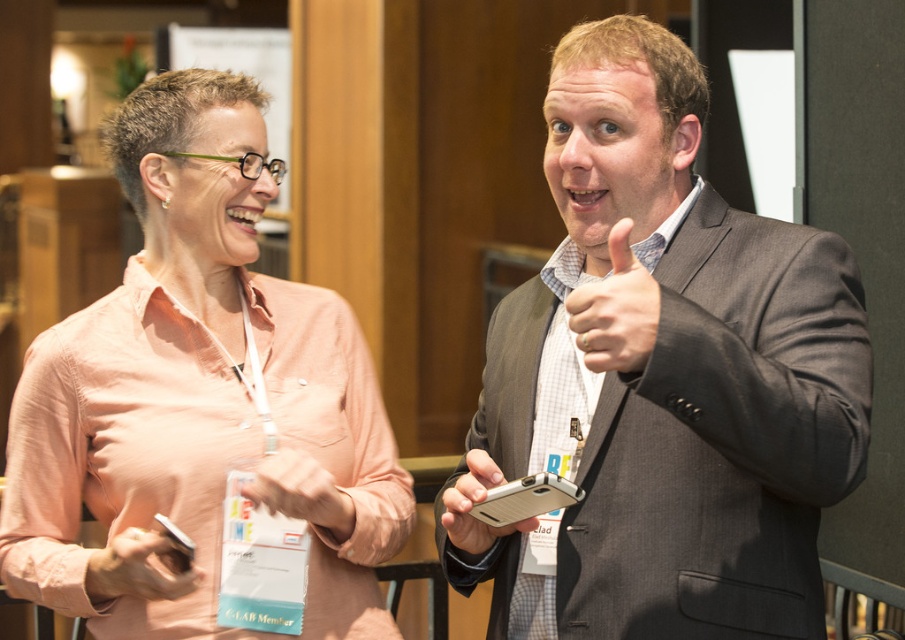
Describe the element at coordinates (138, 568) in the screenshot. I see `matte black phone at lower left` at that location.

Which is in front, point (183, 592) or point (483, 497)?

Point (483, 497)

Does point (100, 593) lie behind point (505, 532)?

That is True.

Find the location of a particular element. This screenshot has width=905, height=640. matte black phone at lower left is located at coordinates (138, 568).

What do you see at coordinates (138, 568) in the screenshot? I see `matte black phone at lower left` at bounding box center [138, 568].

Is point (198, 573) positioned in front of point (277, 474)?

Yes, it is in front of point (277, 474).

From the picture: Measure the distance between point (160, 534) and camera.

A distance of 1.84 meters exists between point (160, 534) and camera.

The width and height of the screenshot is (905, 640). Identify the location of matte black phone at lower left. (138, 568).

Locate an element on the screen. This screenshot has height=640, width=905. matte gray hand at center is located at coordinates (616, 308).

Can you confirm if matte gray hand at center is shorter than pink fabric hand at center?

No, matte gray hand at center is not shorter than pink fabric hand at center.

Which is in front, point (625, 253) or point (310, 467)?

Point (625, 253) is more forward.

Find the location of a particular element. This screenshot has width=905, height=640. matte gray hand at center is located at coordinates (616, 308).